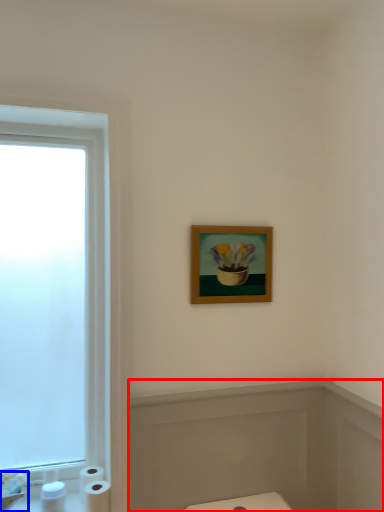
Question: Which point is closer to the camera, bath (highlighted by a red box) or sink (highlighted by a blue box)?

Choices:
 (A) bath
 (B) sink

Answer: (B)